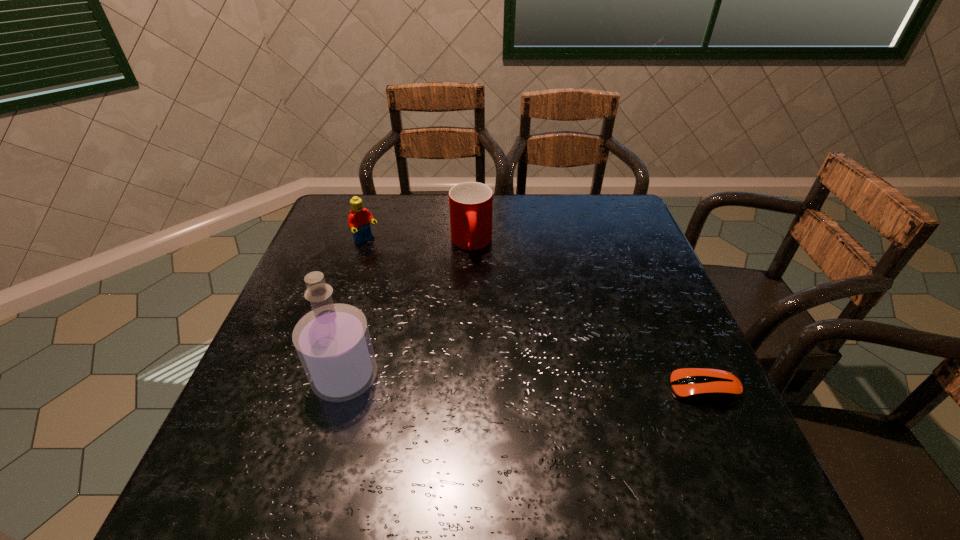
The height and width of the screenshot is (540, 960). I want to click on the tallest object, so click(333, 342).

Identify the location of computer mouse. The image size is (960, 540). (705, 385).

The image size is (960, 540). Find the location of `the shortest object`. the shortest object is located at coordinates (705, 385).

The height and width of the screenshot is (540, 960). Identify the location of cup. (470, 203).

You are a GUI agent. You are given a task and a screenshot of the screen. Output one action in this format:
    pyautogui.click(x=<x>, y=<y>)
    Task: Click on the Lego
    
    Given the screenshot: What is the action you would take?
    pyautogui.click(x=359, y=219)

In order to click on free space located on the back of the perfume in this screenshot , I will do `click(374, 272)`.

You are a GUI agent. You are given a task and a screenshot of the screen. Output one action in this format:
    pyautogui.click(x=<x>, y=<y>)
    Task: Click on the blank space located 0.160m on the back of the shortest object
    
    Given the screenshot: What is the action you would take?
    pyautogui.click(x=672, y=318)

Image resolution: width=960 pixels, height=540 pixels. In order to click on free space located 0.280m on the side of the third object from left to right with the handle in this screenshot , I will do `click(477, 341)`.

Find the location of a particular element. The height and width of the screenshot is (540, 960). blank space located 0.310m on the side of the third object from left to right with the handle is located at coordinates (477, 352).

You are a GUI agent. You are given a task and a screenshot of the screen. Output one action in this format:
    pyautogui.click(x=<x>, y=<y>)
    Task: Click on the vacant space located on the side of the third object from left to right with the handle
    This screenshot has height=540, width=960.
    Given the screenshot: What is the action you would take?
    pyautogui.click(x=473, y=276)